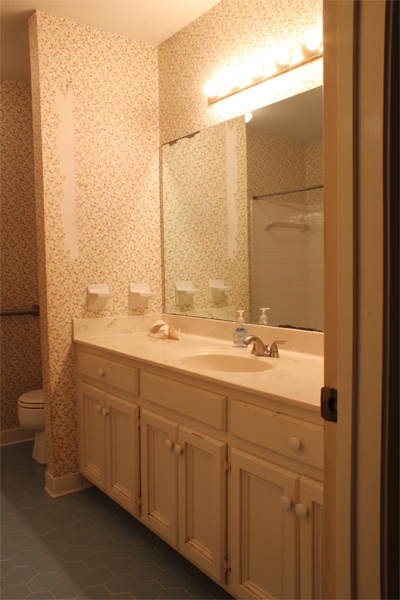
You are a GUI agent. You are given a task and a screenshot of the screen. Output one action in this format:
    pyautogui.click(x=<x>, y=<y>)
    Task: Click on the sink
    
    Given the screenshot: What is the action you would take?
    pyautogui.click(x=225, y=364)